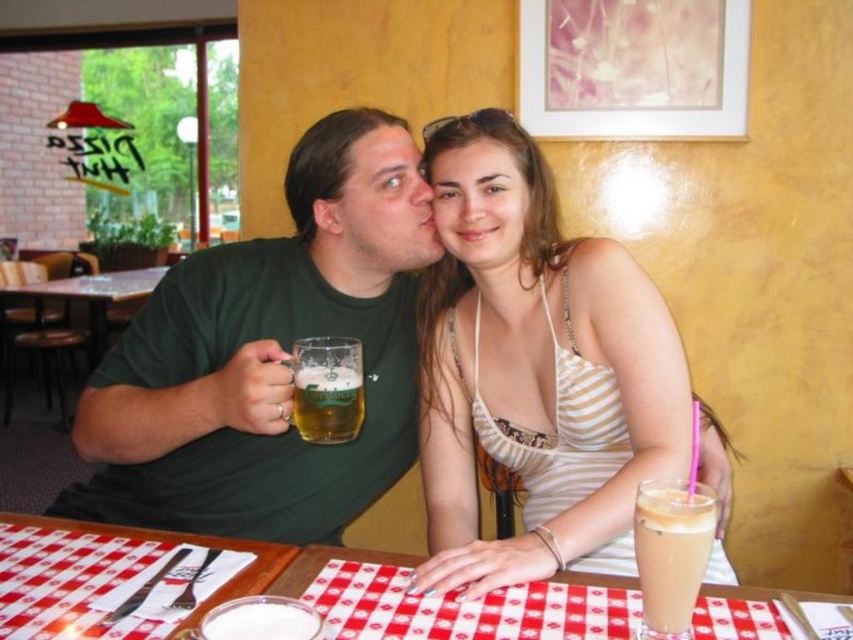
In the scene shown: Between red checkered tablecloth at center and iced coffee at lower right, which one is positioned higher?

iced coffee at lower right is above.

Does red checkered tablecloth at center have a greater height compared to iced coffee at lower right?

Incorrect, red checkered tablecloth at center's height is not larger of iced coffee at lower right's.

Is point (213, 592) farther from camera compared to point (706, 529)?

Yes, it is.

Where is `red checkered tablecloth at center`? red checkered tablecloth at center is located at coordinates (276, 589).

What do you see at coordinates (535, 369) in the screenshot? The image size is (853, 640). I see `white striped tank top at center` at bounding box center [535, 369].

Does point (459, 164) come farther from viewer compared to point (454, 636)?

That is True.

The width and height of the screenshot is (853, 640). I want to click on white striped tank top at center, so click(x=535, y=369).

At what (x,y) coordinates should I click in order to perform the action: click on white striped tank top at center. Please return your answer as a coordinate pair (x, y). Looking at the image, I should click on (535, 369).

Which is below, white striped tank top at center or red checkered tablecloth at lower left?

Positioned lower is red checkered tablecloth at lower left.

Is white striped tank top at center above red checkered tablecloth at lower left?

Correct, white striped tank top at center is located above red checkered tablecloth at lower left.

Identify the location of white striped tank top at center. The height and width of the screenshot is (640, 853). (535, 369).